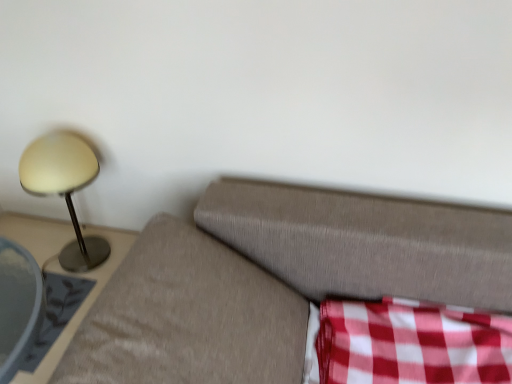
In order to click on free space above matte gold lamp at left (from a real-world perspective) in this screenshot , I will do `click(53, 153)`.